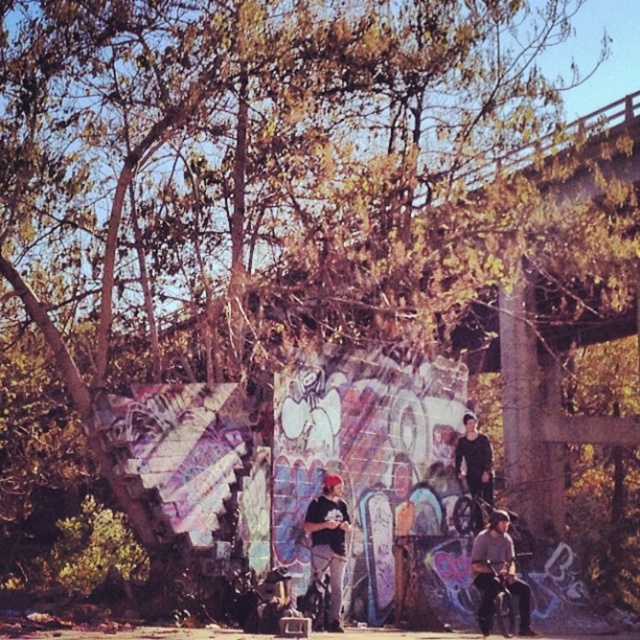
Which is more to the left, denim jacket at lower right or matte black cap at center?

matte black cap at center is more to the left.

Can you confirm if denim jacket at lower right is positioned to the left of matte black cap at center?

In fact, denim jacket at lower right is to the right of matte black cap at center.

What are the coordinates of `denim jacket at lower right` in the screenshot? It's located at (497, 573).